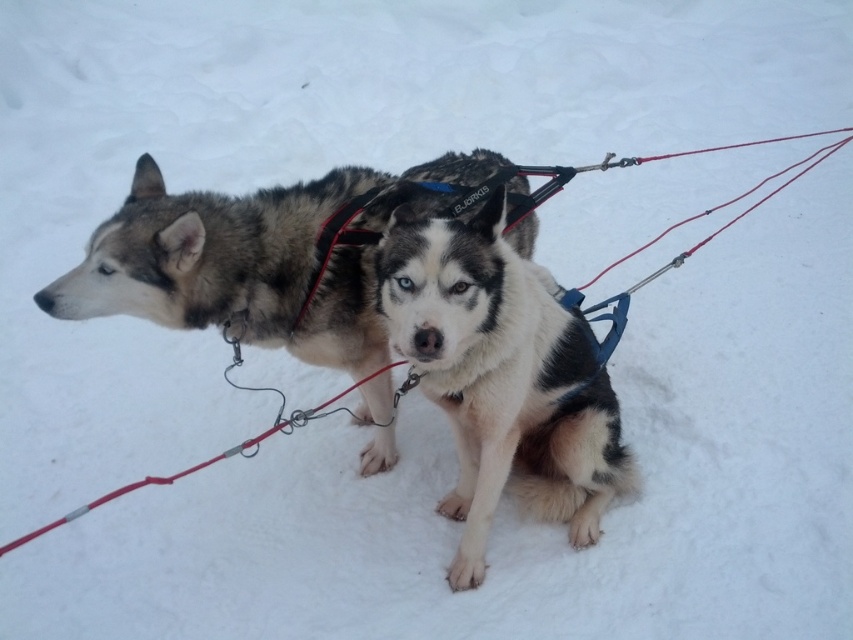
Question: Is white fur dog at center above fluffy fur husky at center?

Choices:
 (A) no
 (B) yes

Answer: (A)

Question: Among these objects, which one is nearest to the camera?

Choices:
 (A) white fur dog at center
 (B) fluffy fur husky at center

Answer: (A)

Question: Does white fur dog at center have a greater width compared to fluffy fur husky at center?

Choices:
 (A) no
 (B) yes

Answer: (A)

Question: Which point is farther to the camera?

Choices:
 (A) white fur dog at center
 (B) fluffy fur husky at center

Answer: (B)

Question: Is white fur dog at center smaller than fluffy fur husky at center?

Choices:
 (A) no
 (B) yes

Answer: (B)